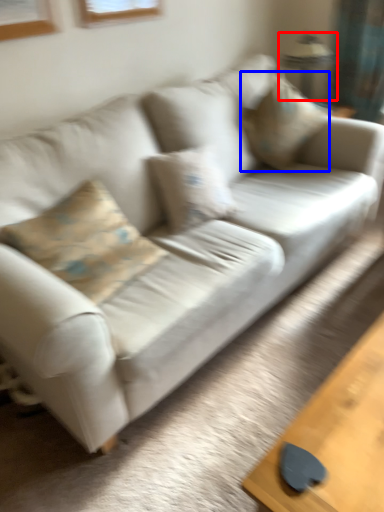
Question: Which object appears closest to the camera in this image, lamp (highlighted by a red box) or pillow (highlighted by a blue box)?

Choices:
 (A) lamp
 (B) pillow

Answer: (B)